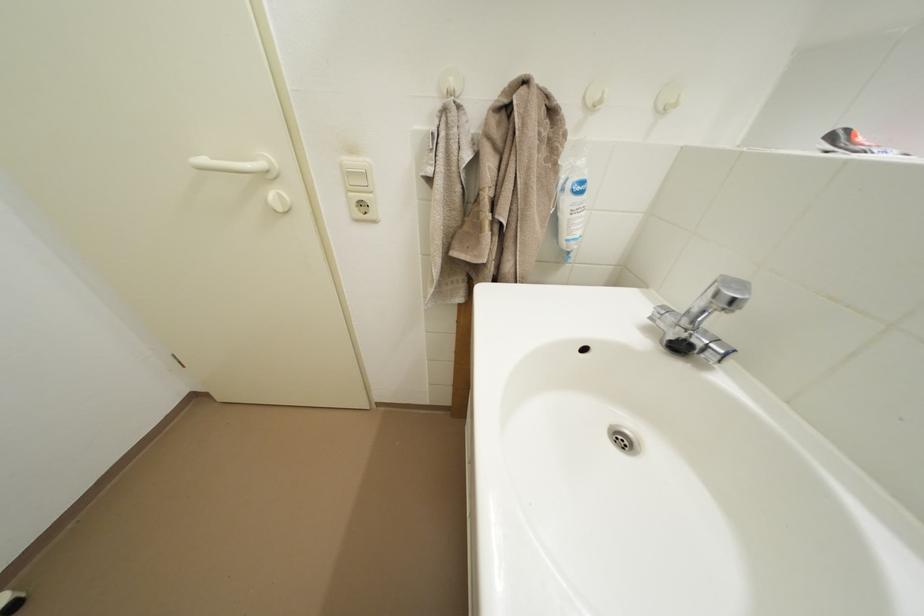
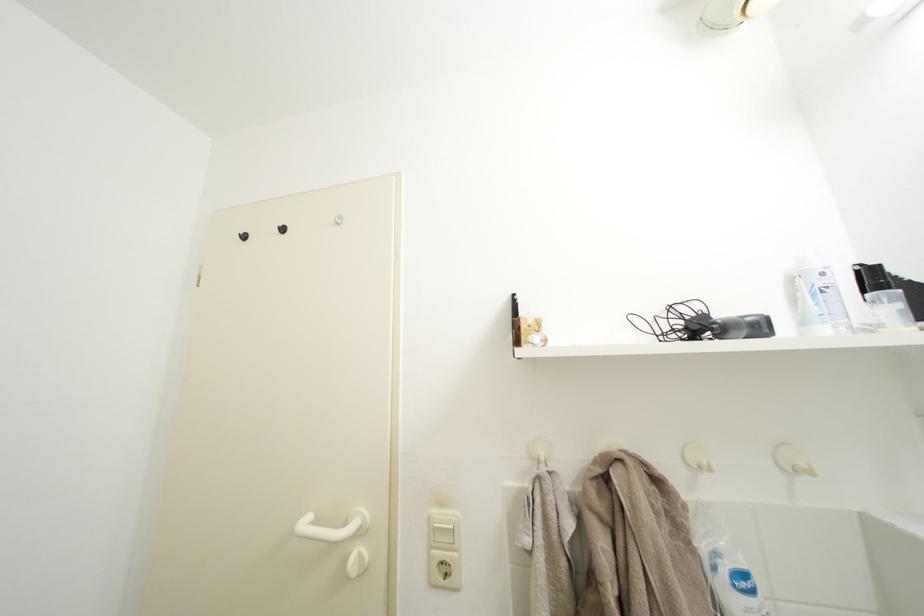
Locate, in the second image, the point that corresponds to (x=212, y=167) in the first image.

(314, 528)